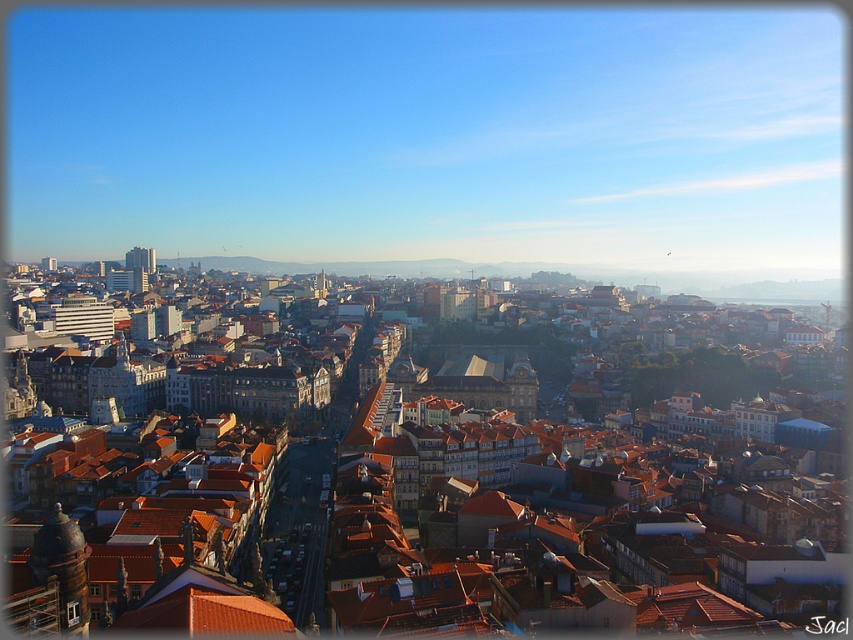
From the picture: You are standing in the city and want to take a photo of the brown stone tower at lower left and the matte white building at center. Which one should you zoom in on first to ensure both are in focus?

The brown stone tower at lower left is closer to the viewer than the matte white building at center, so you should zoom in on the matte white building at center first to ensure both are in focus.

You are standing at the camera position and want to take a photo of the brown stone tower at lower left. Given that your camera has a maximum zoom range of 100 meters, can you capture the tower without moving closer?

The brown stone tower at lower left and camera are 100.44 meters apart, so the distance is slightly beyond the camera maximum zoom range of 100 meters. You need to move closer to capture the tower.

You are standing at the center of the city and see two points marked in the image. The first point is at coordinate point(49, 563) and the second point is at coordinate point(134, 248). Which point is closer to you?

Point(49, 563) is in front of point(134, 248), so it is closer to you.